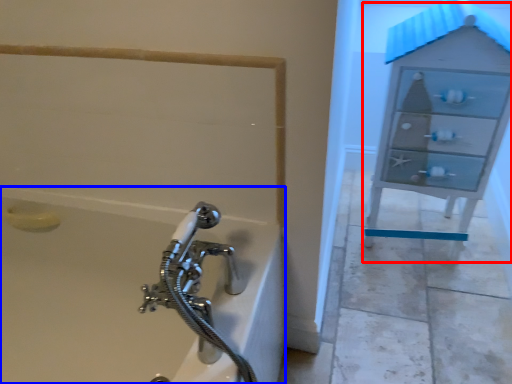
Question: Among these objects, which one is nearest to the camera, file cabinet (highlighted by a red box) or bathtub (highlighted by a blue box)?

Choices:
 (A) file cabinet
 (B) bathtub

Answer: (B)